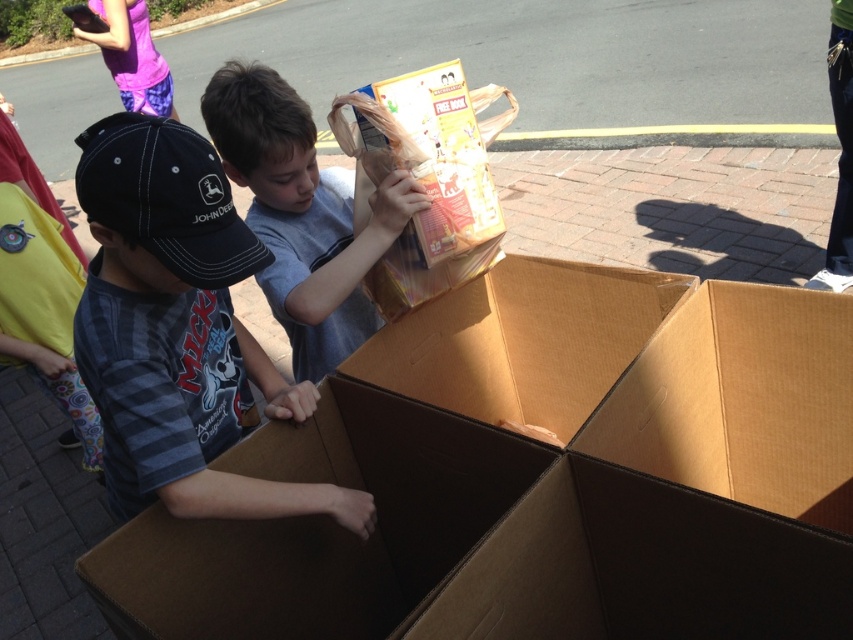
You are a volunteer at the food packing event. You need to place a heavy box onto a table that is 1 meter away from the matte gray shirt at center. Is the distance sufficient to safely move the box without hitting any nearby objects?

The matte gray shirt at center is located at point (302, 214), but without specific information about the surrounding objects or the path to the table, it is impossible to determine if the distance is sufficient. Please check the area for obstacles before moving the box.

You are a volunteer helping organize food boxes. You have two volunteers wearing the striped cotton shirt at center and the matte gray shirt at center. You need to assign the volunteer with the smaller size shirt to lift lighter boxes. Which volunteer should you assign to lift lighter boxes?

The striped cotton shirt at center has a smaller size compared to matte gray shirt at center, so the volunteer wearing the striped cotton shirt at center should be assigned to lift lighter boxes since they are smaller in size.

You are a volunteer helping to organize food boxes. You see the matte gray shirt at center and the matte cardboard box at center. Which object is positioned lower from the ground?

The matte gray shirt at center is located below matte cardboard box at center, so the matte gray shirt at center is positioned lower from the ground.